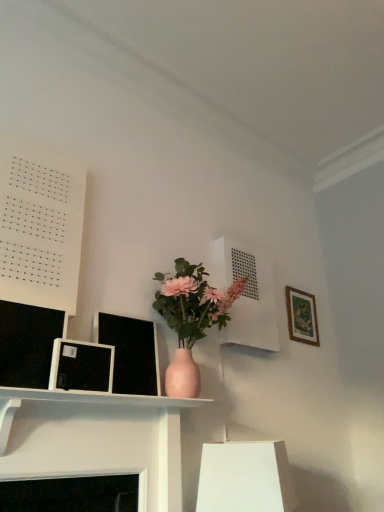
Question: Is matte white shelf at center, arranged as the second shelf when viewed from the right, bigger than wooden picture frame at upper right, positioned as the first picture frame in back-to-front order?

Choices:
 (A) no
 (B) yes

Answer: (B)

Question: Can you confirm if matte white shelf at center, placed as the 2th shelf when sorted from back to front, is taller than wooden picture frame at upper right, positioned as the first picture frame in back-to-front order?

Choices:
 (A) yes
 (B) no

Answer: (B)

Question: Does matte white shelf at center, arranged as the second shelf when viewed from the right, appear on the right side of wooden picture frame at upper right, positioned as the first picture frame in back-to-front order?

Choices:
 (A) yes
 (B) no

Answer: (B)

Question: Is matte white shelf at center, the first shelf in the left-to-right sequence, at the left side of wooden picture frame at upper right, the second picture frame from the left?

Choices:
 (A) no
 (B) yes

Answer: (B)

Question: Is the depth of matte white shelf at center, the first shelf from the front, less than that of wooden picture frame at upper right, the first picture frame positioned from the right?

Choices:
 (A) no
 (B) yes

Answer: (B)

Question: Considering the positions of matte white shelf at center, arranged as the second shelf when viewed from the right, and wooden picture frame at upper right, the first picture frame positioned from the right, in the image, is matte white shelf at center, arranged as the second shelf when viewed from the right, wider or thinner than wooden picture frame at upper right, the first picture frame positioned from the right,?

Choices:
 (A) wide
 (B) thin

Answer: (A)

Question: In terms of height, does matte white shelf at center, the first shelf from the front, look taller or shorter compared to wooden picture frame at upper right, the second picture frame from the left?

Choices:
 (A) short
 (B) tall

Answer: (A)

Question: From the image's perspective, relative to wooden picture frame at upper right, which ranks as the 2th picture frame in front-to-back order, is matte white shelf at center, placed as the 2th shelf when sorted from back to front, above or below?

Choices:
 (A) above
 (B) below

Answer: (B)

Question: Is matte white shelf at center, the first shelf in the left-to-right sequence, bigger or smaller than wooden picture frame at upper right, positioned as the first picture frame in back-to-front order?

Choices:
 (A) small
 (B) big

Answer: (B)

Question: Based on their positions, is matte black picture frame at left, placed as the second picture frame when sorted from back to front, located to the left or right of wooden picture frame at upper right, positioned as the first picture frame in back-to-front order?

Choices:
 (A) left
 (B) right

Answer: (A)

Question: From their relative heights in the image, would you say matte black picture frame at left, the second picture frame when ordered from right to left, is taller or shorter than wooden picture frame at upper right, the first picture frame positioned from the right?

Choices:
 (A) tall
 (B) short

Answer: (B)

Question: In terms of size, does matte black picture frame at left, placed as the second picture frame when sorted from back to front, appear bigger or smaller than wooden picture frame at upper right, which ranks as the 2th picture frame in front-to-back order?

Choices:
 (A) small
 (B) big

Answer: (A)

Question: Considering their positions, is matte black picture frame at left, which ranks as the 1th picture frame in front-to-back order, located in front of or behind wooden picture frame at upper right, positioned as the first picture frame in back-to-front order?

Choices:
 (A) front
 (B) behind

Answer: (A)

Question: Is wooden picture frame at upper right, the second picture frame from the left, in front of or behind white paper at upper left in the image?

Choices:
 (A) behind
 (B) front

Answer: (A)

Question: From the image's perspective, is wooden picture frame at upper right, the second picture frame from the left, above or below white paper at upper left?

Choices:
 (A) above
 (B) below

Answer: (B)